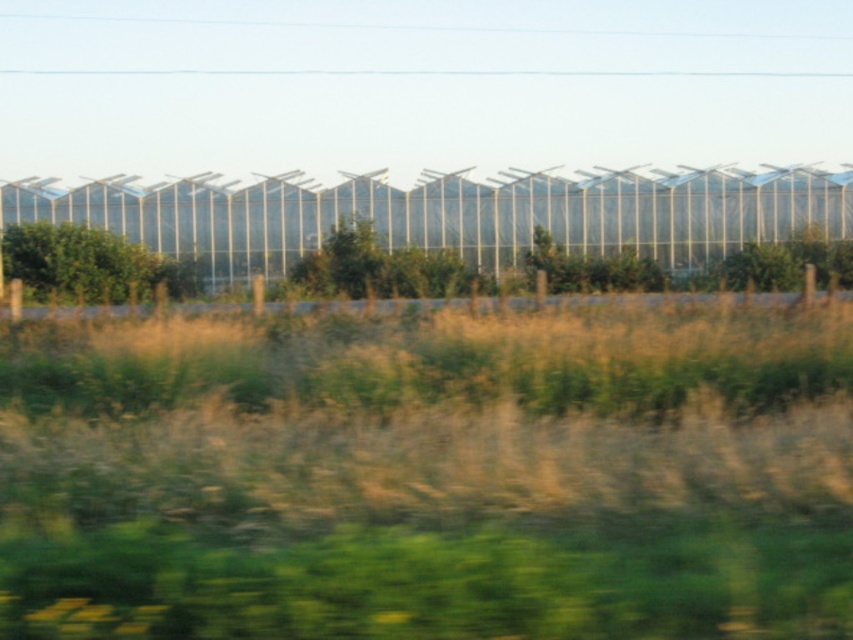
Question: Is green grass at center below green leafy tree at left?

Choices:
 (A) yes
 (B) no

Answer: (A)

Question: Which of the following is the closest to the observer?

Choices:
 (A) green grass at center
 (B) green leafy tree at left

Answer: (A)

Question: Among these points, which one is nearest to the camera?

Choices:
 (A) (543, 403)
 (B) (70, 262)

Answer: (A)

Question: Can you confirm if green grass at center is positioned below green leafy tree at left?

Choices:
 (A) no
 (B) yes

Answer: (B)

Question: Where is green grass at center located in relation to green leafy tree at left in the image?

Choices:
 (A) left
 (B) right

Answer: (B)